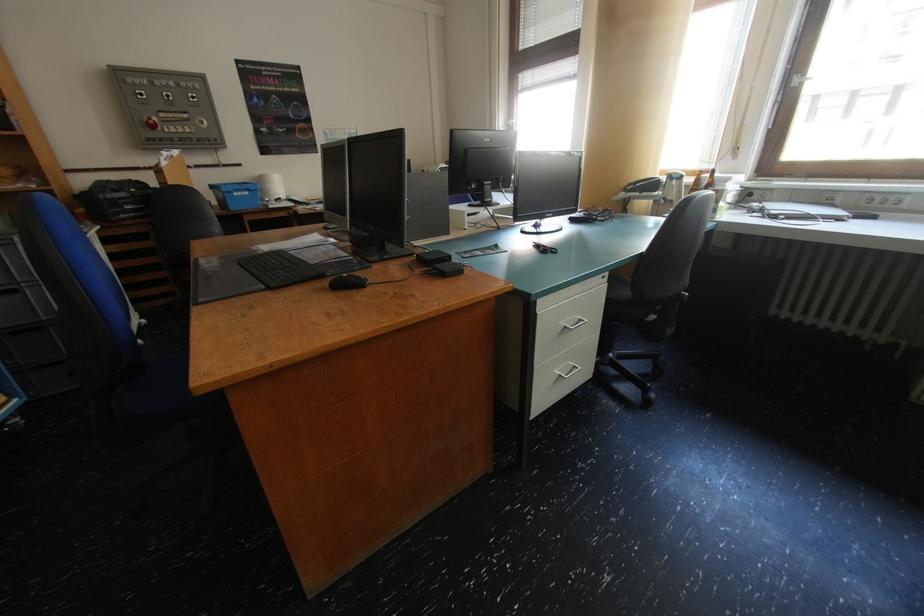
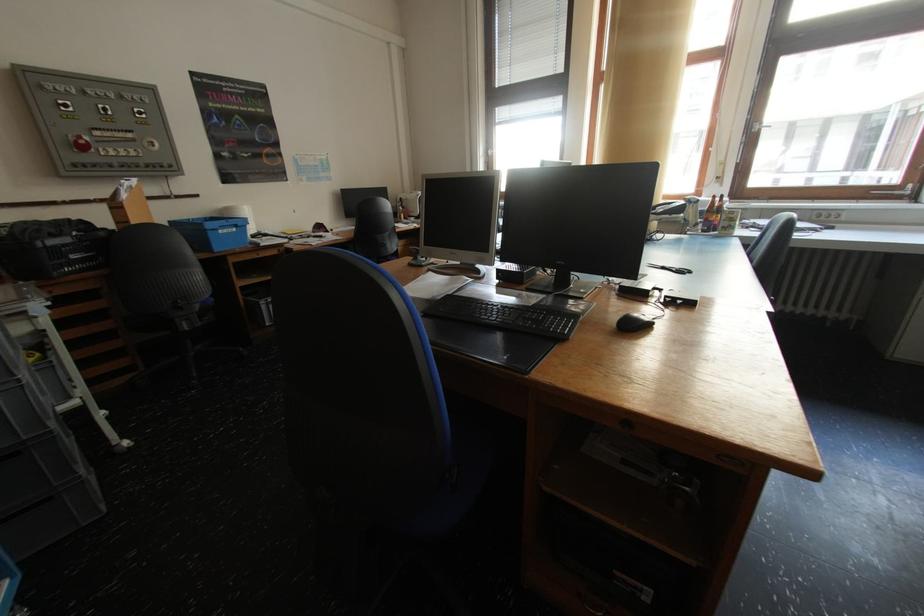
The point at (149, 99) is marked in the first image. Where is the corresponding point in the second image?

(71, 110)